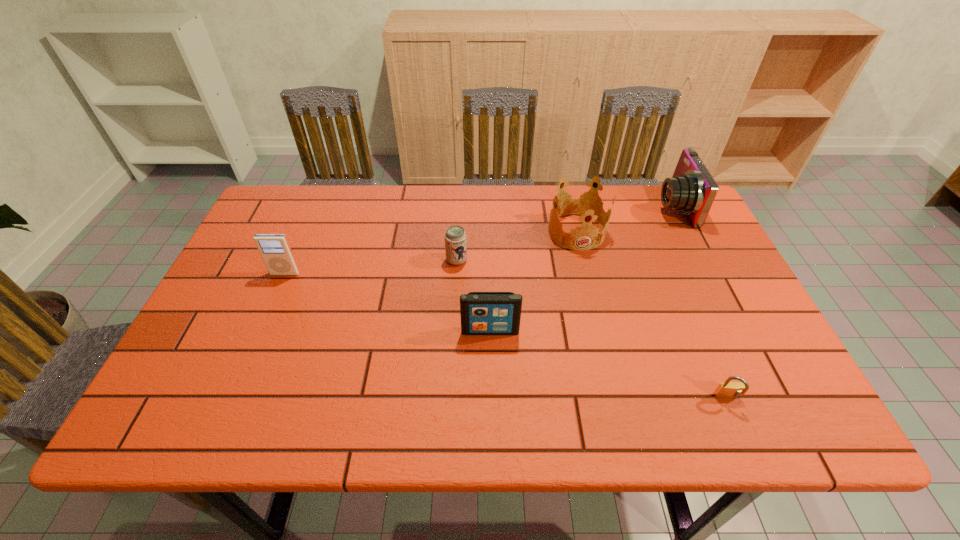
Where is `the third closest object relative to the camera`? This screenshot has width=960, height=540. the third closest object relative to the camera is located at coordinates (482, 313).

The height and width of the screenshot is (540, 960). Identify the location of the third closest object to the right iPod. (726, 390).

Find the location of a particular element. This screenshot has height=540, width=960. blank area in the image that satisfies the following two spatial constraints: 1. on the front-facing side of the rightmost object; 2. on the front screen of the nearer iPod is located at coordinates (735, 331).

In order to click on vacant space that satisfies the following two spatial constraints: 1. on the front-facing side of the camera; 2. on the side with the combination dials of the shortest object in this screenshot , I will do `click(769, 399)`.